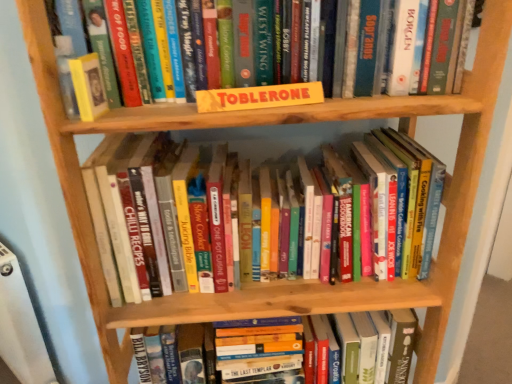
Question: Considering the relative sizes of yellow cardboard sign at upper center, which appears as the 1th book when viewed from the top, and yellow cardboard toblerone at center, acting as the second paperback book starting from the left, in the image provided, is yellow cardboard sign at upper center, which appears as the 1th book when viewed from the top, smaller than yellow cardboard toblerone at center, acting as the second paperback book starting from the left,?

Choices:
 (A) yes
 (B) no

Answer: (B)

Question: Does yellow cardboard sign at upper center, which ranks as the third book in bottom-to-top order, have a lesser width compared to yellow cardboard toblerone at center, acting as the second paperback book starting from the left?

Choices:
 (A) no
 (B) yes

Answer: (A)

Question: From the image's perspective, would you say yellow cardboard sign at upper center, which ranks as the third book in bottom-to-top order, is shown under yellow cardboard toblerone at center, the first paperback book when ordered from right to left?

Choices:
 (A) yes
 (B) no

Answer: (B)

Question: Considering the relative positions of yellow cardboard sign at upper center, which appears as the 1th book when viewed from the top, and yellow cardboard toblerone at center, acting as the second paperback book starting from the left, in the image provided, is yellow cardboard sign at upper center, which appears as the 1th book when viewed from the top, to the left of yellow cardboard toblerone at center, acting as the second paperback book starting from the left, from the viewer's perspective?

Choices:
 (A) yes
 (B) no

Answer: (A)

Question: Does yellow cardboard sign at upper center, which ranks as the third book in bottom-to-top order, contain yellow cardboard toblerone at center, the first paperback book when ordered from right to left?

Choices:
 (A) no
 (B) yes

Answer: (A)

Question: Is yellow cardboard sign at upper center, which appears as the 1th book when viewed from the top, positioned far away from yellow cardboard toblerone at center, the first paperback book when ordered from right to left?

Choices:
 (A) no
 (B) yes

Answer: (A)

Question: From a real-world perspective, is hardcover books at center, which is counted as the 2th book, starting from the top, below hardcover book at center, which appears as the 1th book when ordered from the bottom?

Choices:
 (A) no
 (B) yes

Answer: (A)

Question: Is hardcover books at center, which is counted as the 2th book, starting from the top, smaller than hardcover book at center, which appears as the 1th book when ordered from the bottom?

Choices:
 (A) no
 (B) yes

Answer: (B)

Question: Is hardcover books at center, which is the second book from bottom to top, facing towards hardcover book at center, which appears as the 1th book when ordered from the bottom?

Choices:
 (A) no
 (B) yes

Answer: (A)

Question: From a real-world perspective, is hardcover books at center, which is the second book from bottom to top, physically above hardcover book at center, acting as the third book starting from the top?

Choices:
 (A) yes
 (B) no

Answer: (A)

Question: Considering the relative sizes of hardcover books at center, which is counted as the 2th book, starting from the top, and hardcover book at center, which appears as the 1th book when ordered from the bottom, in the image provided, is hardcover books at center, which is counted as the 2th book, starting from the top, taller than hardcover book at center, which appears as the 1th book when ordered from the bottom,?

Choices:
 (A) no
 (B) yes

Answer: (B)

Question: From the image's perspective, does hardcover books at center, which is the second book from bottom to top, appear lower than hardcover book at center, acting as the third book starting from the top?

Choices:
 (A) yes
 (B) no

Answer: (B)

Question: Is yellow cardboard sign at upper center, which appears as the 1th book when viewed from the top, shorter than hardcover book at center, which appears as the 1th book when ordered from the bottom?

Choices:
 (A) yes
 (B) no

Answer: (A)